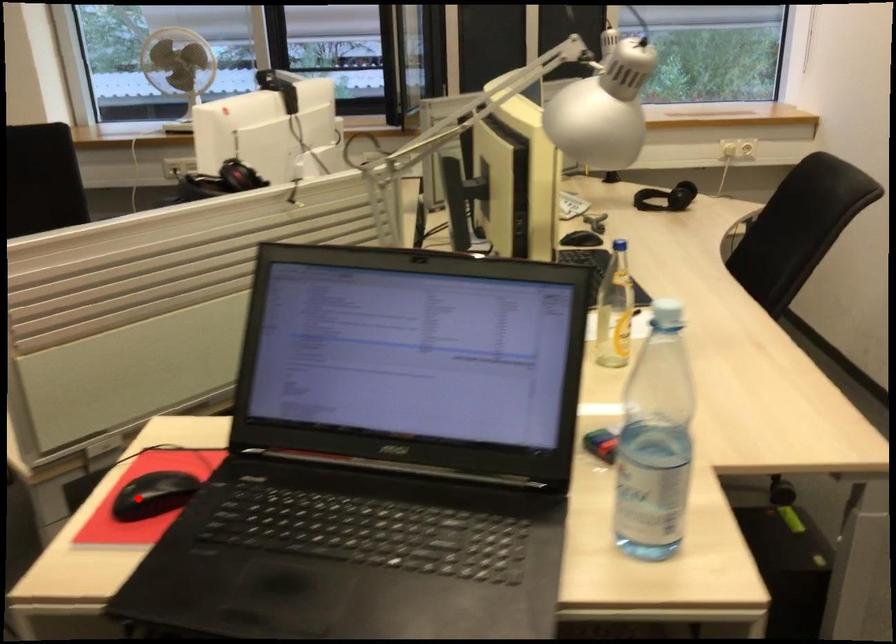
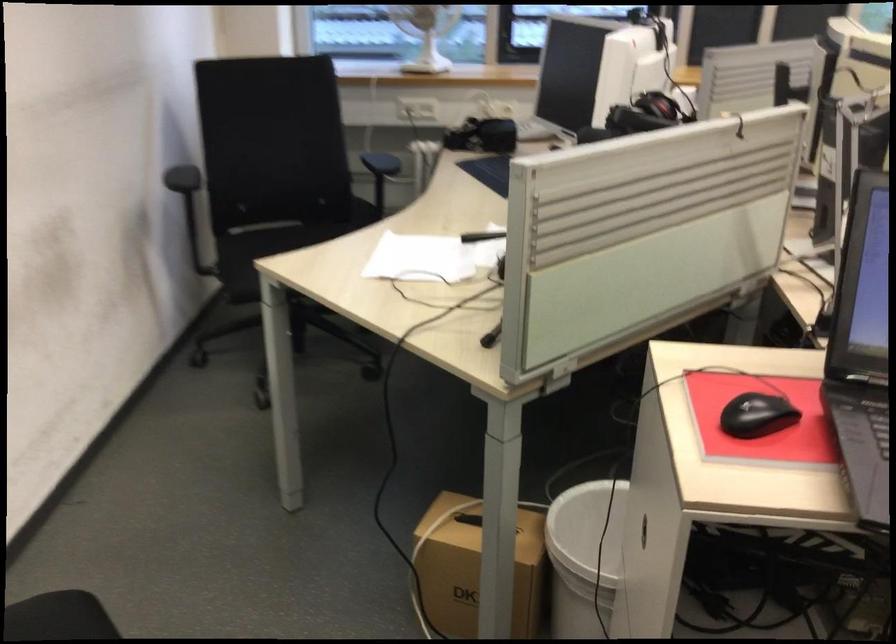
Locate, in the second image, the point that corresponds to the highlighted location in the first image.

(756, 415)